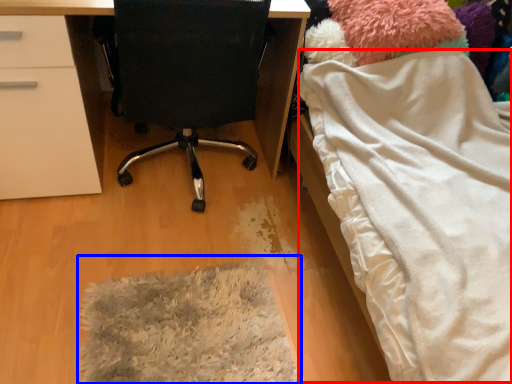
Question: Which object appears farthest to the camera in this image, blanket (highlighted by a red box) or mat (highlighted by a blue box)?

Choices:
 (A) blanket
 (B) mat

Answer: (B)